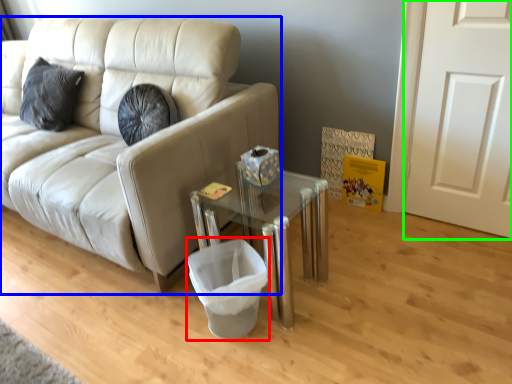
Question: Which object is positioned farthest from laundry basket (highlighted by a red box)? Select from studio couch (highlighted by a blue box) and door (highlighted by a green box).

Choices:
 (A) studio couch
 (B) door

Answer: (B)